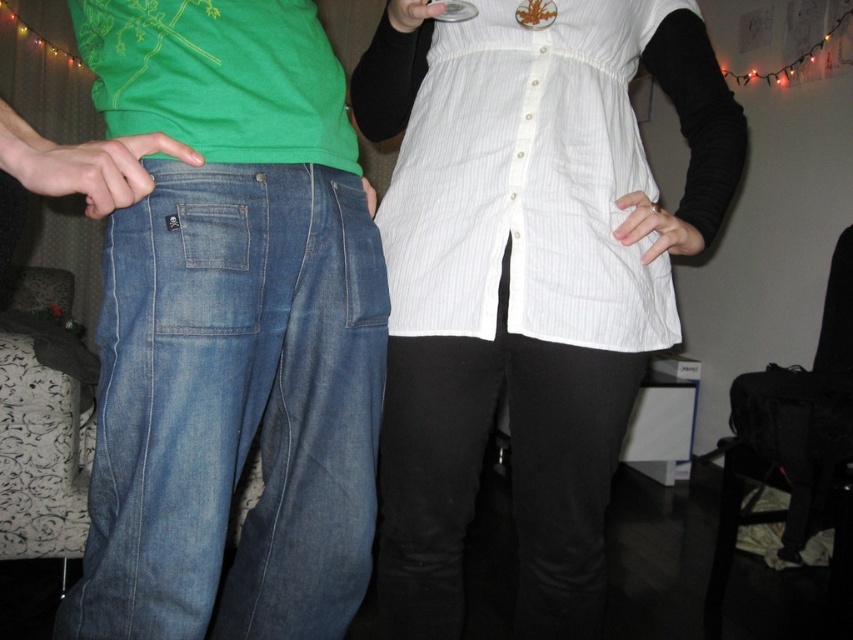
Question: Which point appears farthest from the camera in this image?

Choices:
 (A) (262, 36)
 (B) (589, 209)

Answer: (B)

Question: In this image, where is white striped apron at center located relative to matte green t-shirt at center?

Choices:
 (A) left
 (B) right

Answer: (B)

Question: In this image, where is white striped apron at center located relative to matte green t-shirt at center?

Choices:
 (A) right
 (B) left

Answer: (A)

Question: Considering the relative positions of white striped apron at center and matte green t-shirt at center in the image provided, where is white striped apron at center located with respect to matte green t-shirt at center?

Choices:
 (A) right
 (B) left

Answer: (A)